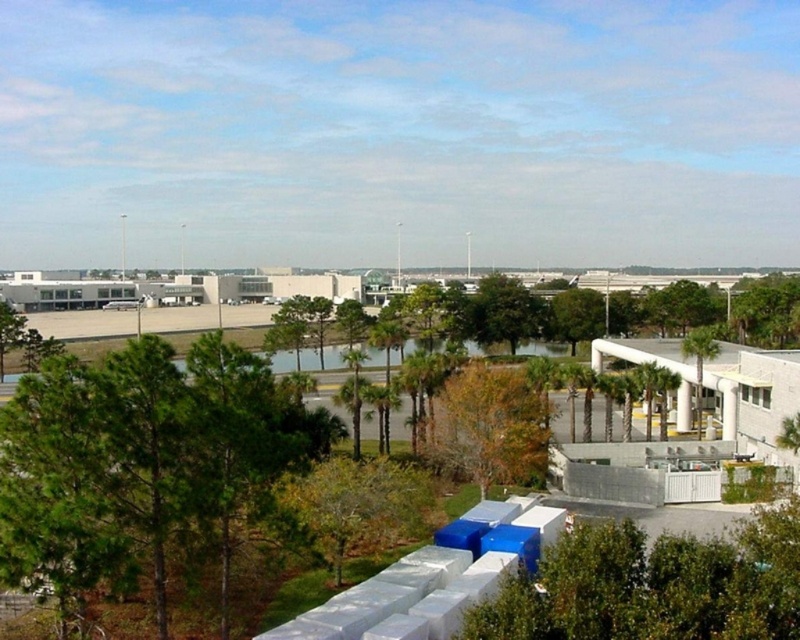
Does brown leafy tree at center have a greater height compared to green leafy palm tree at center-right?

No, brown leafy tree at center is not taller than green leafy palm tree at center-right.

Who is positioned more to the left, brown leafy tree at center or green leafy palm tree at center-right?

Positioned to the left is brown leafy tree at center.

Does point (448, 396) come farther from viewer compared to point (713, 344)?

No, (448, 396) is closer to viewer.

Find the location of a particular element. The image size is (800, 640). brown leafy tree at center is located at coordinates (490, 426).

Can you confirm if green leafy tree at lower right is smaller than brown leafy tree at center?

Yes.

I want to click on green leafy tree at lower right, so click(x=654, y=586).

Does green leafy tree at lower right have a lesser height compared to green leafy palm tree at center-right?

Correct, green leafy tree at lower right is not as tall as green leafy palm tree at center-right.

Who is more distant from viewer, (746, 529) or (684, 340)?

The point (684, 340) is behind.

Does point (728, 616) come closer to viewer compared to point (700, 428)?

Yes.

I want to click on green leafy tree at lower right, so click(x=654, y=586).